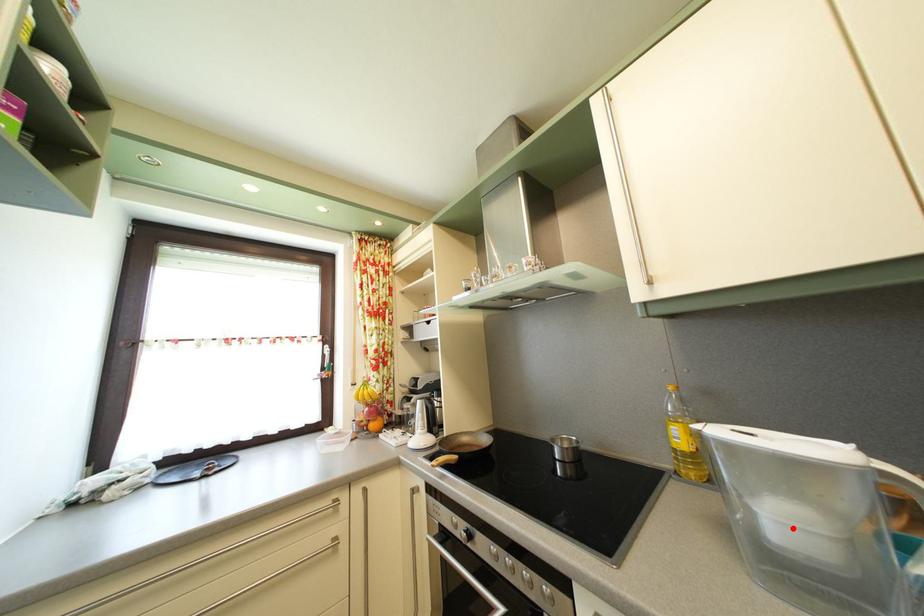
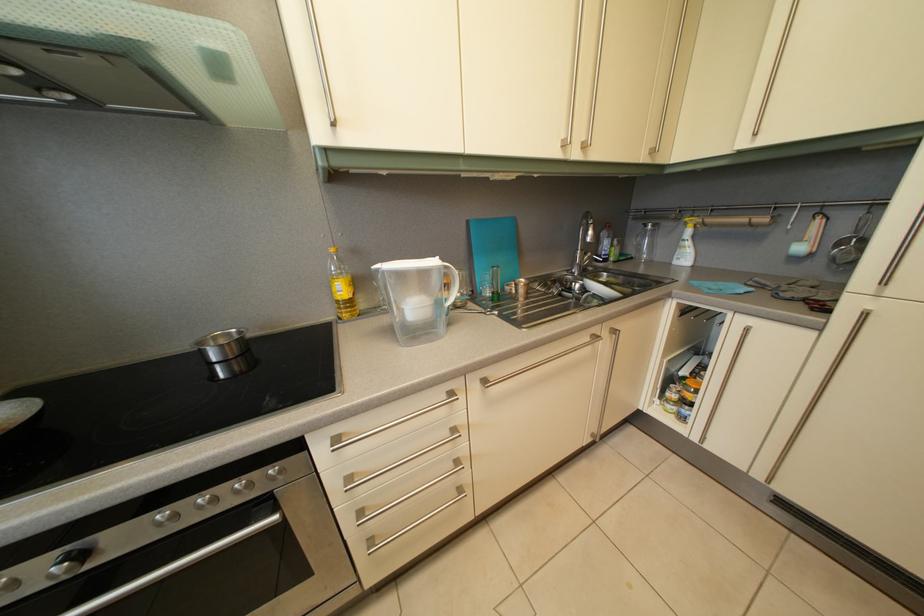
Where in the second image is the point corresponding to the highlighted location from the first image?

(421, 315)